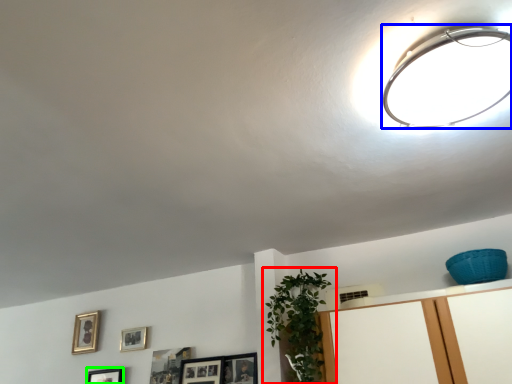
Question: Which is farther away from houseplant (highlighted by a red box)? lamp (highlighted by a blue box) or picture frame (highlighted by a green box)?

Choices:
 (A) lamp
 (B) picture frame

Answer: (B)